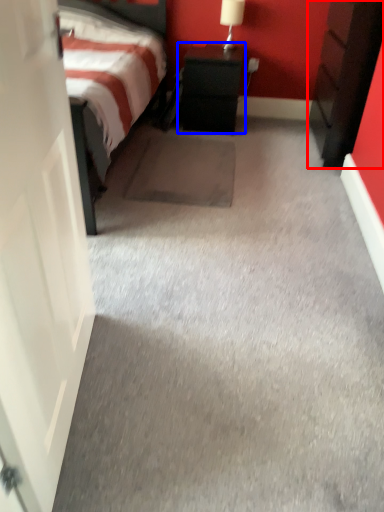
Question: Which of the following is the closest to the observer, nightstand (highlighted by a red box) or nightstand (highlighted by a blue box)?

Choices:
 (A) nightstand
 (B) nightstand

Answer: (A)